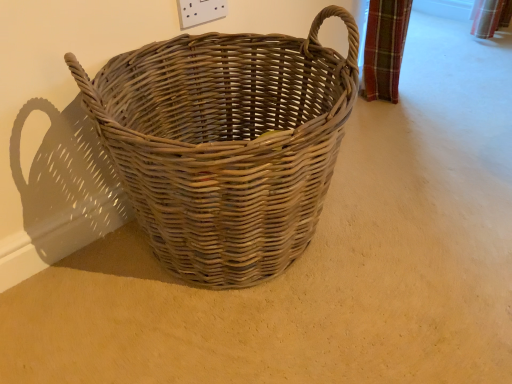
The width and height of the screenshot is (512, 384). Find the location of `free space in front of natural wicker basket at center`. free space in front of natural wicker basket at center is located at coordinates (238, 300).